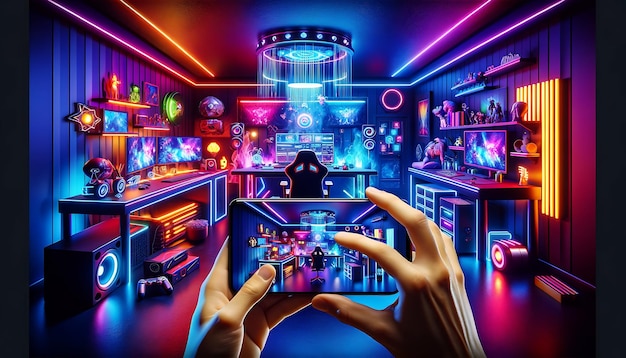
This screenshot has width=626, height=358. I want to click on countertop, so click(x=130, y=194), click(x=483, y=183).